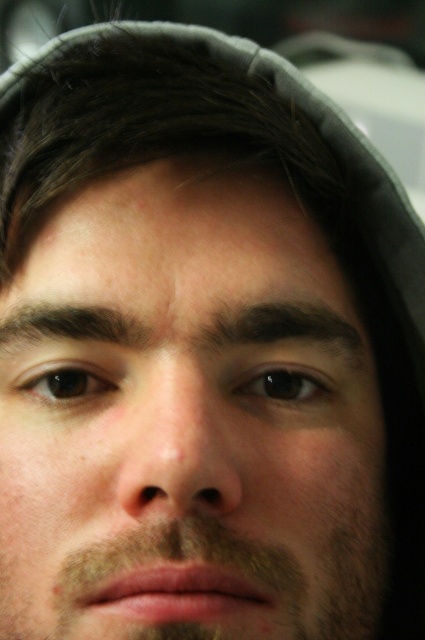
Looking at this image, between smooth skin face at center and brown fuzzy beard at lower center, which one has less height?

brown fuzzy beard at lower center is shorter.

Between smooth skin face at center and brown fuzzy beard at lower center, which one appears on the right side from the viewer's perspective?

brown fuzzy beard at lower center is more to the right.

Find the location of a particular element. smooth skin face at center is located at coordinates (187, 419).

The width and height of the screenshot is (425, 640). I want to click on smooth skin face at center, so click(187, 419).